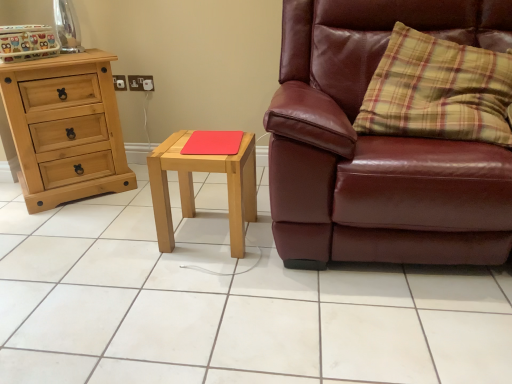
Locate an element on the screen. vacant space underneath light wood/matte nightstand at center (from a real-world perspective) is located at coordinates (205, 234).